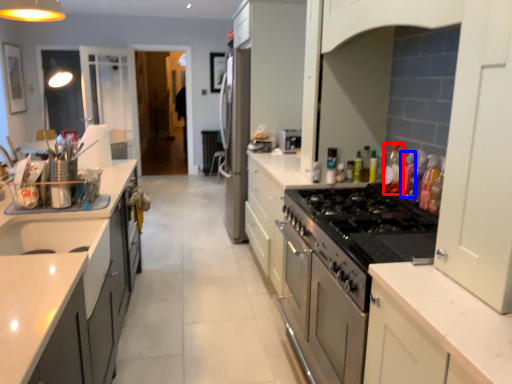
Question: Among these objects, which one is farthest to the camera, bottle (highlighted by a red box) or bottle (highlighted by a blue box)?

Choices:
 (A) bottle
 (B) bottle

Answer: (A)